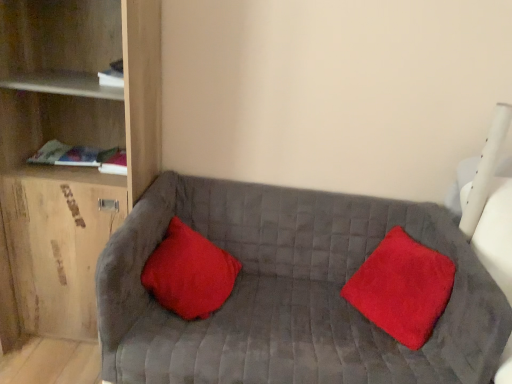
Question: Is red plush pillow at center, arranged as the second pillow when viewed from the left, turned away from wooden shelf at left?

Choices:
 (A) no
 (B) yes

Answer: (A)

Question: Considering the relative sizes of red plush pillow at center, marked as the first pillow in a right-to-left arrangement, and wooden shelf at left in the image provided, is red plush pillow at center, marked as the first pillow in a right-to-left arrangement, smaller than wooden shelf at left?

Choices:
 (A) no
 (B) yes

Answer: (B)

Question: Is red plush pillow at center, arranged as the second pillow when viewed from the left, at the right side of wooden shelf at left?

Choices:
 (A) yes
 (B) no

Answer: (A)

Question: Is red plush pillow at center, marked as the first pillow in a right-to-left arrangement, closer to the viewer compared to wooden shelf at left?

Choices:
 (A) yes
 (B) no

Answer: (B)

Question: Considering the relative positions of red plush pillow at center, arranged as the second pillow when viewed from the left, and wooden shelf at left in the image provided, is red plush pillow at center, arranged as the second pillow when viewed from the left, to the left of wooden shelf at left from the viewer's perspective?

Choices:
 (A) yes
 (B) no

Answer: (B)

Question: From the image's perspective, is wooden shelf at left positioned above or below velvet gray couch at center?

Choices:
 (A) below
 (B) above

Answer: (B)

Question: From a real-world perspective, is wooden shelf at left positioned above or below velvet gray couch at center?

Choices:
 (A) below
 (B) above

Answer: (B)

Question: In the image, is wooden shelf at left positioned in front of or behind velvet gray couch at center?

Choices:
 (A) behind
 (B) front

Answer: (A)

Question: Does point (96, 137) appear closer or farther from the camera than point (250, 329)?

Choices:
 (A) closer
 (B) farther

Answer: (B)

Question: Which is correct: red plush pillow at center, arranged as the second pillow when viewed from the left, is inside velvet gray couch at center, or outside of it?

Choices:
 (A) inside
 (B) outside

Answer: (A)

Question: Is red plush pillow at center, marked as the first pillow in a right-to-left arrangement, in front of or behind velvet gray couch at center in the image?

Choices:
 (A) behind
 (B) front

Answer: (A)

Question: In the image, is red plush pillow at center, arranged as the second pillow when viewed from the left, on the left side or the right side of velvet gray couch at center?

Choices:
 (A) right
 (B) left

Answer: (A)

Question: Considering the positions of point (399, 306) and point (325, 218), is point (399, 306) closer or farther from the camera than point (325, 218)?

Choices:
 (A) closer
 (B) farther

Answer: (A)

Question: Is red plush pillow at center, arranged as the second pillow when viewed from the left, bigger or smaller than red velvet pillow at center, acting as the 2th pillow starting from the right?

Choices:
 (A) small
 (B) big

Answer: (B)

Question: Does point (380, 261) appear closer or farther from the camera than point (167, 236)?

Choices:
 (A) farther
 (B) closer

Answer: (A)